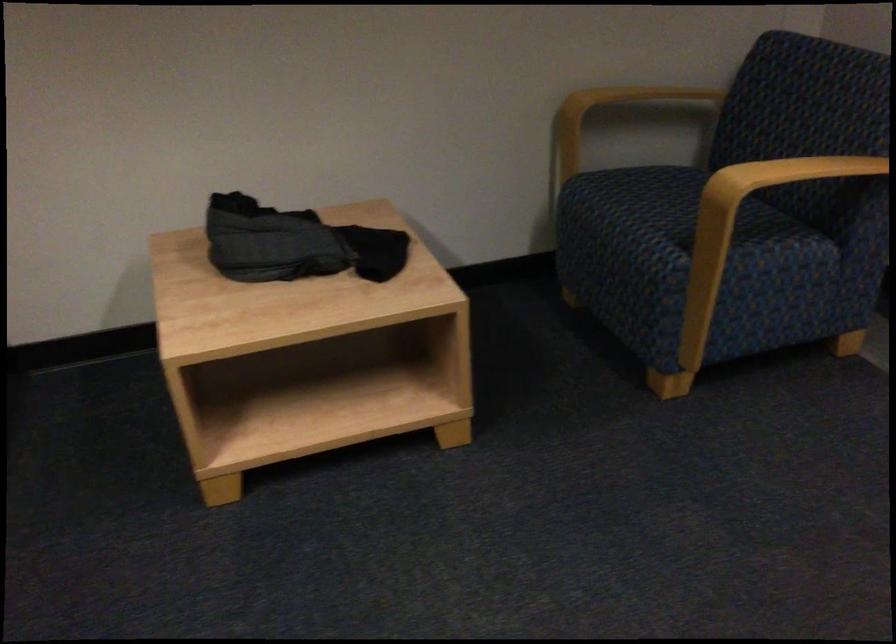
The width and height of the screenshot is (896, 644). Identify the location of chair sitting surface. (659, 209).